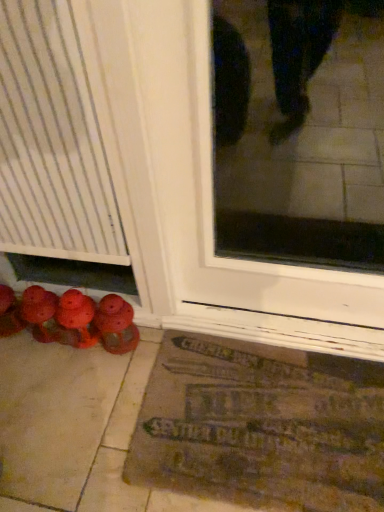
Question: Is matte red shoes at lower left, positioned as the first footwear in right-to-left order, to the left of brown textured mat at lower center from the viewer's perspective?

Choices:
 (A) yes
 (B) no

Answer: (A)

Question: Could you tell me if matte red shoes at lower left, positioned as the 2th footwear in left-to-right order, is turned towards brown textured mat at lower center?

Choices:
 (A) no
 (B) yes

Answer: (A)

Question: From a real-world perspective, is matte red shoes at lower left, positioned as the first footwear in right-to-left order, beneath brown textured mat at lower center?

Choices:
 (A) yes
 (B) no

Answer: (B)

Question: Does matte red shoes at lower left, positioned as the first footwear in right-to-left order, have a lesser height compared to brown textured mat at lower center?

Choices:
 (A) no
 (B) yes

Answer: (A)

Question: Can you confirm if matte red shoes at lower left, positioned as the first footwear in right-to-left order, is taller than brown textured mat at lower center?

Choices:
 (A) yes
 (B) no

Answer: (A)

Question: From the image's perspective, is matte red shoes at lower left, positioned as the first footwear in right-to-left order, located beneath brown textured mat at lower center?

Choices:
 (A) yes
 (B) no

Answer: (B)

Question: Is matte red shoes at lower left, which appears as the 1th footwear when viewed from the left, thinner than brown textured mat at lower center?

Choices:
 (A) no
 (B) yes

Answer: (B)

Question: Does matte red shoes at lower left, which appears as the 1th footwear when viewed from the left, have a greater width compared to brown textured mat at lower center?

Choices:
 (A) yes
 (B) no

Answer: (B)

Question: Is matte red shoes at lower left, which is counted as the second footwear, starting from the right, completely or partially outside of brown textured mat at lower center?

Choices:
 (A) yes
 (B) no

Answer: (A)

Question: Considering the relative sizes of matte red shoes at lower left, which appears as the 1th footwear when viewed from the left, and brown textured mat at lower center in the image provided, is matte red shoes at lower left, which appears as the 1th footwear when viewed from the left, taller than brown textured mat at lower center?

Choices:
 (A) no
 (B) yes

Answer: (B)

Question: From a real-world perspective, is matte red shoes at lower left, which is counted as the second footwear, starting from the right, physically below brown textured mat at lower center?

Choices:
 (A) yes
 (B) no

Answer: (B)

Question: Can you confirm if matte red shoes at lower left, which is counted as the second footwear, starting from the right, is smaller than brown textured mat at lower center?

Choices:
 (A) yes
 (B) no

Answer: (A)

Question: Does brown textured mat at lower center have a greater width compared to matte red shoes at lower left, positioned as the 2th footwear in left-to-right order?

Choices:
 (A) yes
 (B) no

Answer: (A)